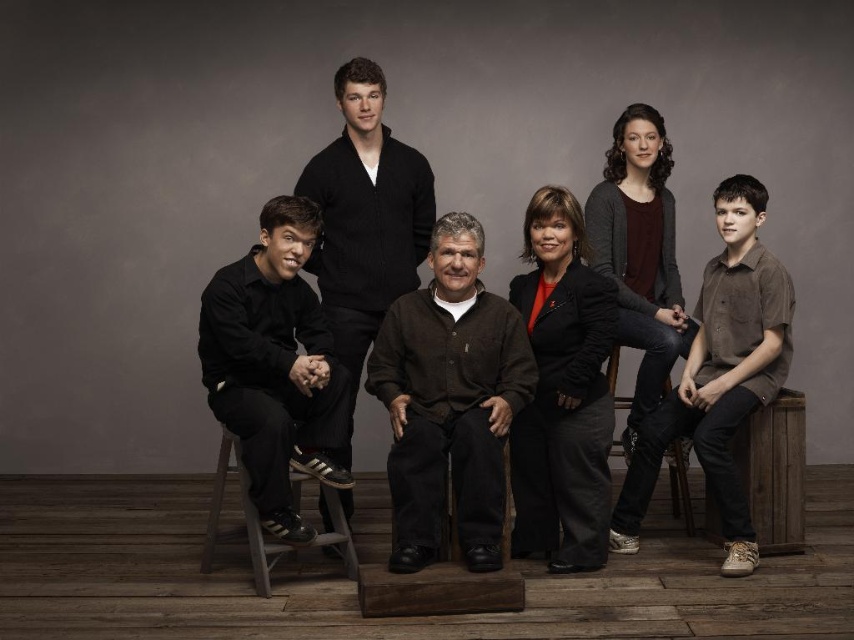
Question: Considering the relative positions of black matte shirt at left and wooden chair at lower right in the image provided, where is black matte shirt at left located with respect to wooden chair at lower right?

Choices:
 (A) left
 (B) right

Answer: (A)

Question: Among these objects, which one is nearest to the camera?

Choices:
 (A) wooden stool at lower left
 (B) matte black jacket at center
 (C) black matte shirt at left

Answer: (C)

Question: Is black matte shirt at left closer to camera compared to wooden stool at lower left?

Choices:
 (A) no
 (B) yes

Answer: (B)

Question: Considering the real-world distances, which object is closest to the brown cotton shirt at center?

Choices:
 (A) matte black jacket at center
 (B) black matte shirt at left
 (C) wooden chair at lower right
 (D) wooden chair at center

Answer: (D)

Question: Can you confirm if black matte shirt at left is positioned below wooden stool at lower left?

Choices:
 (A) yes
 (B) no

Answer: (B)

Question: Which of the following is the farthest from the observer?

Choices:
 (A) [507, 509]
 (B) [389, 481]

Answer: (A)